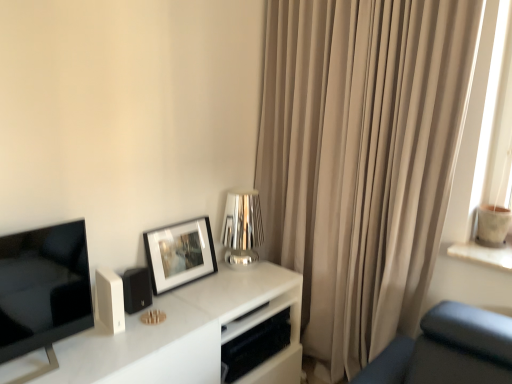
Find the location of `vacant area located to the right-hand side of black glossy television at left`. vacant area located to the right-hand side of black glossy television at left is located at coordinates (109, 360).